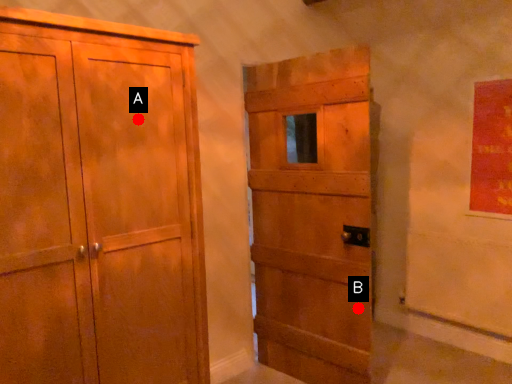
Question: Two points are circled on the image, labeled by A and B beside each circle. Which point appears closest to the camera in this image?

Choices:
 (A) A is closer
 (B) B is closer

Answer: (A)